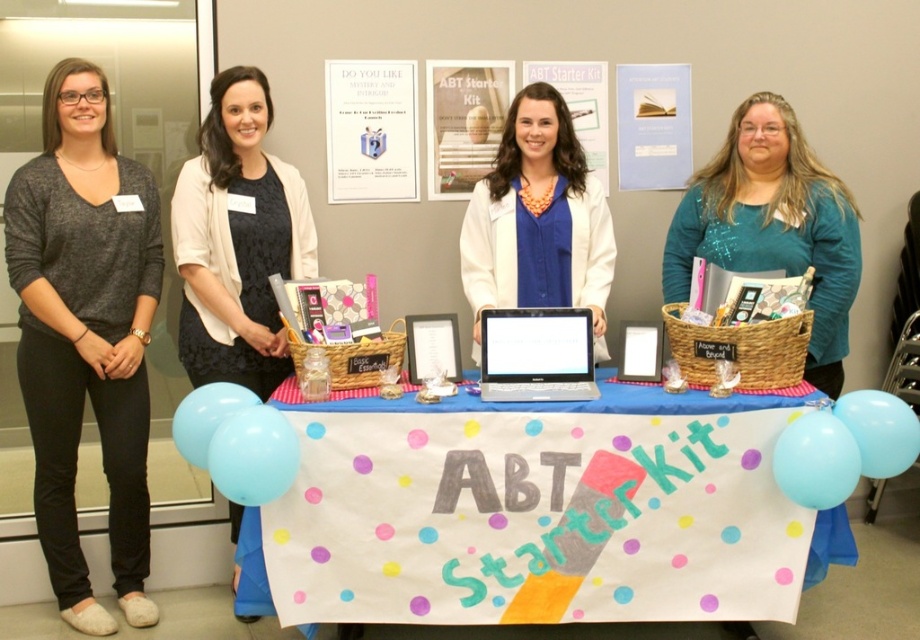
Question: Which point is closer to the camera taking this photo?

Choices:
 (A) (542, 218)
 (B) (745, 100)

Answer: (A)

Question: Can you confirm if matte gray sweater at left is smaller than light blue rubber balloon at lower left?

Choices:
 (A) no
 (B) yes

Answer: (A)

Question: Can you confirm if light blue balloon at lower right is wider than light blue rubber balloon at lower right?

Choices:
 (A) yes
 (B) no

Answer: (A)

Question: Which object is the closest to the black lace dress at center?

Choices:
 (A) light blue balloon at lower right
 (B) light blue rubber balloon at lower left
 (C) light blue balloon at lower left
 (D) teal glittery sweater at center

Answer: (B)

Question: Considering the real-world distances, which object is farthest from the matte gray sweater at left?

Choices:
 (A) matte white lab coat at center
 (B) white paper banner at center

Answer: (A)

Question: Is black lace dress at center bigger than light blue balloon at lower left?

Choices:
 (A) no
 (B) yes

Answer: (B)